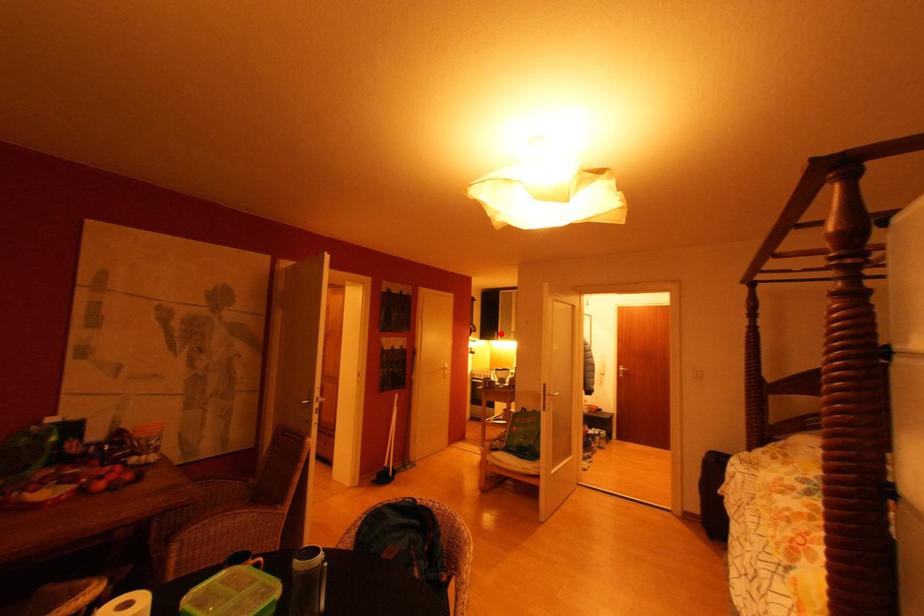
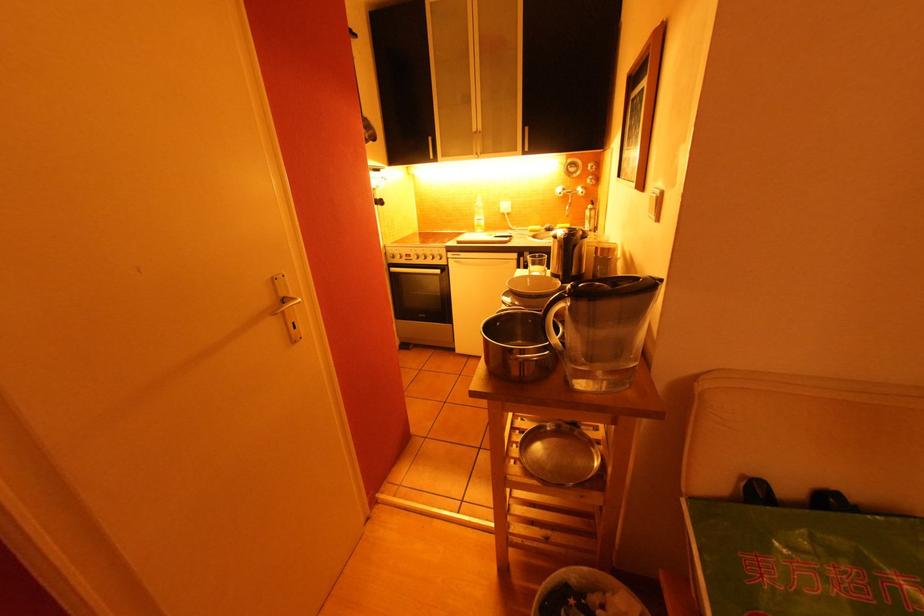
Locate, in the second image, the point that corresponds to the highlighted location in the first image.

(434, 140)